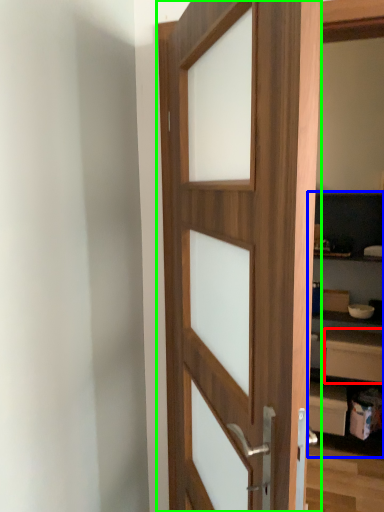
Question: Estimate the real-world distances between objects in this image. Which object is closer to drawer (highlighted by a red box), bookshelf (highlighted by a blue box) or door (highlighted by a green box)?

Choices:
 (A) bookshelf
 (B) door

Answer: (A)